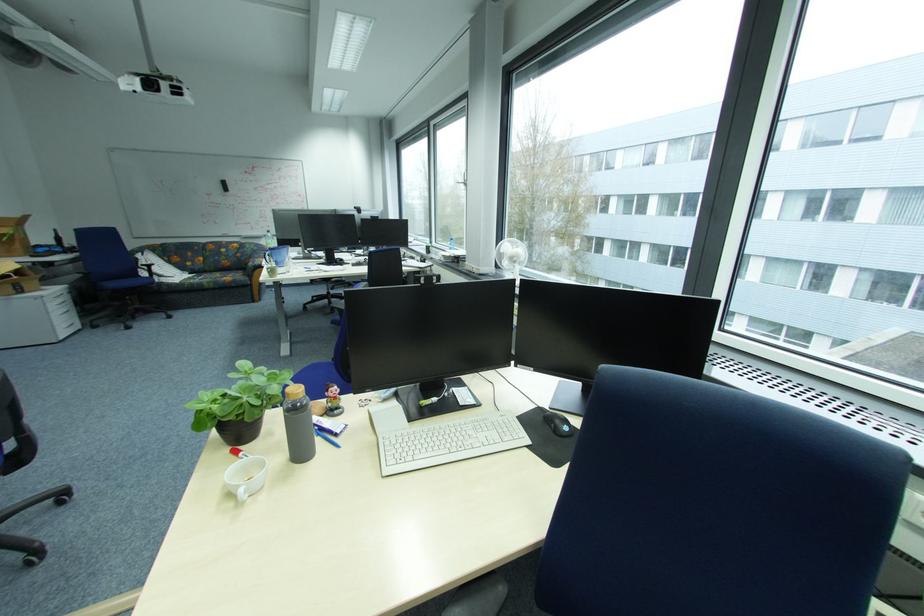
The image size is (924, 616). Identify the location of cabinet drawer handle. (70, 323).